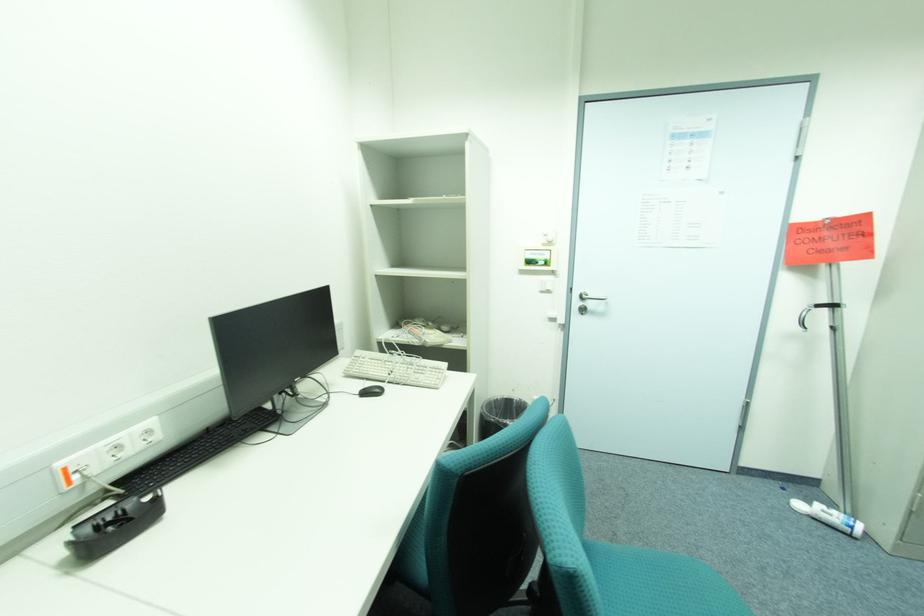
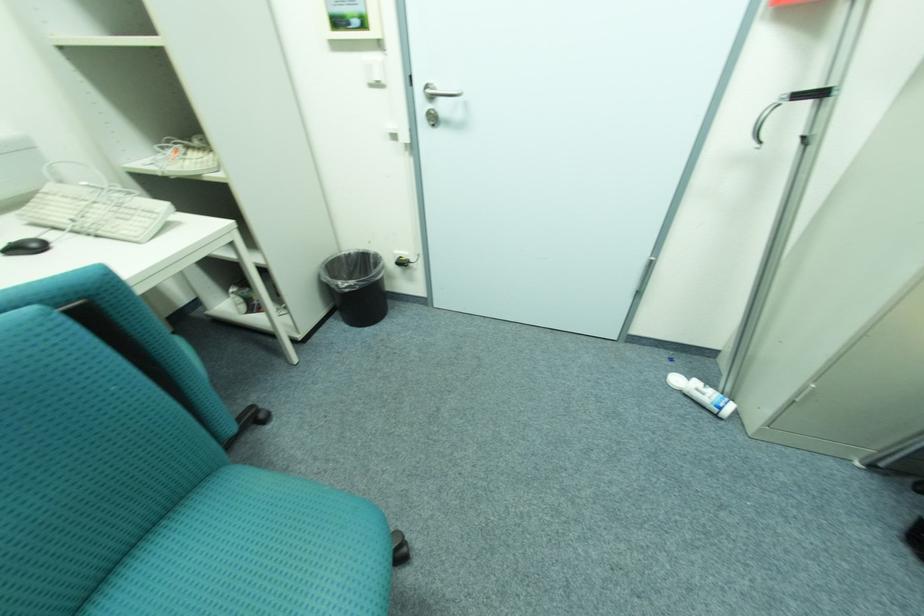
In the second image, find the point that corresponds to point 383,391 in the first image.

(43, 246)